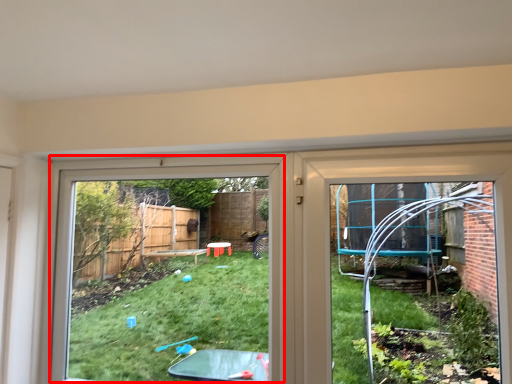
Question: From the image's perspective, what is the correct spatial relationship of bay window (annotated by the red box) in relation to door?

Choices:
 (A) below
 (B) above

Answer: (A)